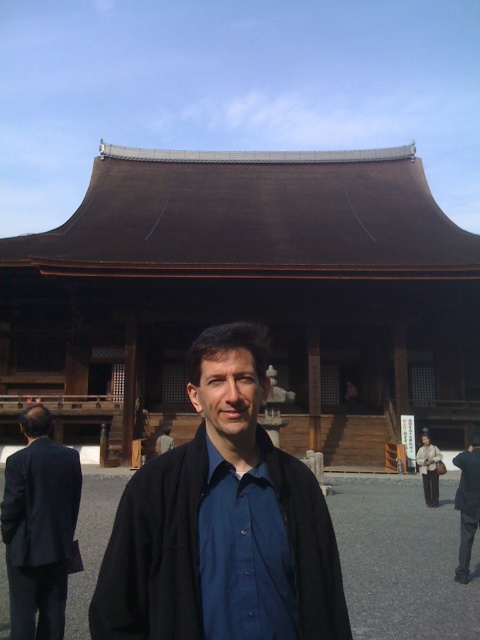
You are a photographer trying to capture the traditional Japanese building in the image. You notice a point at coordinates (243, 556) which marks the blue smooth shirt at center. Where should you focus your camera to ensure the building is in the background while keeping the person in the foreground?

The point at coordinates (243, 556) marks the blue smooth shirt at center, so you should focus on the building behind the person wearing the blue smooth shirt at center to ensure the building is in the background while keeping the person in the foreground.

Based on the coordinates provided, what is located at point (253, 292) in the image?

The point (253, 292) indicates the location of the brown wooden temple at center.

You are a photographer trying to capture the person standing in front of the temple. You notice the black matte jacket at lower right and the dark gray fabric robe at lower right. Which clothing item is closer to the camera?

The black matte jacket at lower right is closer to the camera because it is in front of the dark gray fabric robe at lower right.